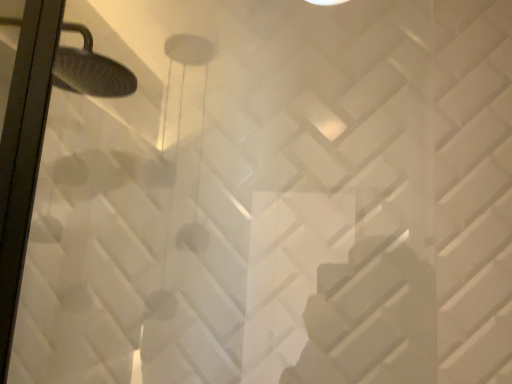
Describe the element at coordinates (90, 70) in the screenshot. I see `matte black showerhead at upper left` at that location.

Identify the location of matte black showerhead at upper left. The image size is (512, 384). (90, 70).

Identify the location of matte black showerhead at upper left. Image resolution: width=512 pixels, height=384 pixels. (90, 70).